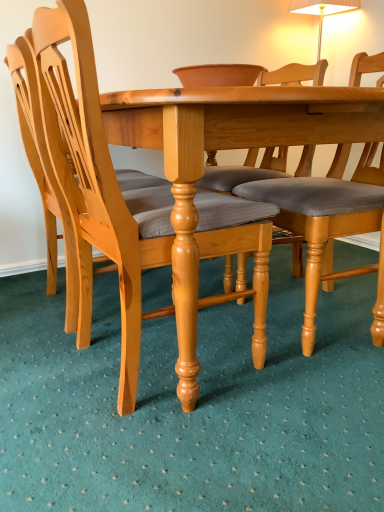
Question: Is light brown wood chair at center, the 1th chair viewed from the right, thinner than light brown wood chair at left, placed as the second chair when sorted from right to left?

Choices:
 (A) no
 (B) yes

Answer: (A)

Question: Is light brown wood chair at center, the 3th chair when ordered from left to right, facing towards light brown wood chair at left, acting as the second chair starting from the left?

Choices:
 (A) yes
 (B) no

Answer: (A)

Question: From a real-world perspective, is light brown wood chair at center, the 1th chair viewed from the right, positioned over light brown wood chair at left, acting as the second chair starting from the left, based on gravity?

Choices:
 (A) yes
 (B) no

Answer: (A)

Question: Considering the relative sizes of light brown wood chair at center, the 3th chair when ordered from left to right, and light brown wood chair at left, placed as the second chair when sorted from right to left, in the image provided, is light brown wood chair at center, the 3th chair when ordered from left to right, bigger than light brown wood chair at left, placed as the second chair when sorted from right to left,?

Choices:
 (A) yes
 (B) no

Answer: (B)

Question: From a real-world perspective, is light brown wood chair at center, the 3th chair when ordered from left to right, under light brown wood chair at left, acting as the second chair starting from the left?

Choices:
 (A) yes
 (B) no

Answer: (B)

Question: Is light brown wood chair at left, acting as the second chair starting from the left, in front of or behind light wood chair at left, the third chair when ordered from right to left, in the image?

Choices:
 (A) front
 (B) behind

Answer: (A)

Question: Is point (64, 68) closer or farther from the camera than point (14, 95)?

Choices:
 (A) closer
 (B) farther

Answer: (A)

Question: Based on their positions, is light brown wood chair at left, placed as the second chair when sorted from right to left, located to the left or right of light wood chair at left, the third chair when ordered from right to left?

Choices:
 (A) left
 (B) right

Answer: (B)

Question: From a real-world perspective, is light brown wood chair at left, placed as the second chair when sorted from right to left, physically located above or below light wood chair at left, the third chair when ordered from right to left?

Choices:
 (A) below
 (B) above

Answer: (A)

Question: In terms of width, does light brown wood chair at center, the 3th chair when ordered from left to right, look wider or thinner when compared to light brown wood chair at left, acting as the second chair starting from the left?

Choices:
 (A) thin
 (B) wide

Answer: (B)

Question: Looking at the image, does light brown wood chair at center, the 3th chair when ordered from left to right, seem bigger or smaller compared to light brown wood chair at left, acting as the second chair starting from the left?

Choices:
 (A) big
 (B) small

Answer: (B)

Question: From their relative heights in the image, would you say light brown wood chair at center, the 1th chair viewed from the right, is taller or shorter than light brown wood chair at left, acting as the second chair starting from the left?

Choices:
 (A) tall
 (B) short

Answer: (B)

Question: Visually, is light brown wood chair at center, the 3th chair when ordered from left to right, positioned to the left or to the right of light brown wood chair at left, acting as the second chair starting from the left?

Choices:
 (A) left
 (B) right

Answer: (B)

Question: Is light wood chair at left, the third chair when ordered from right to left, inside the boundaries of light brown wood chair at center, the 3th chair when ordered from left to right, or outside?

Choices:
 (A) inside
 (B) outside

Answer: (B)

Question: Is light wood chair at left, which is counted as the 1th chair, starting from the left, bigger or smaller than light brown wood chair at center, the 3th chair when ordered from left to right?

Choices:
 (A) small
 (B) big

Answer: (B)